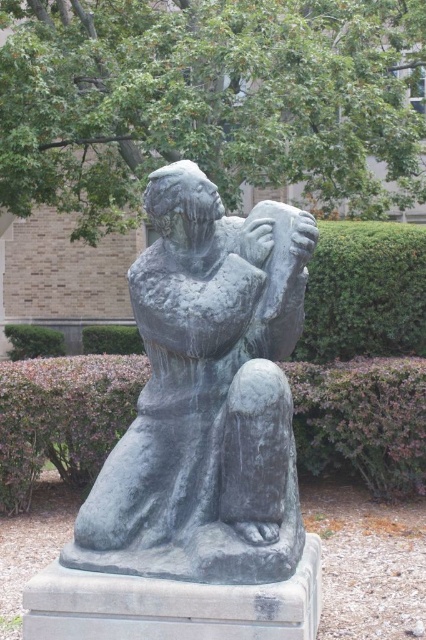
Is green leafy tree at upper center above purple shrubbery at lower center?

Yes.

At what (x,y) coordinates should I click in order to perform the action: click on green leafy tree at upper center. Please return your answer as a coordinate pair (x, y). This screenshot has width=426, height=640. Looking at the image, I should click on (204, 99).

Does green leafy tree at upper center appear on the left side of bronze statue at center?

Correct, you'll find green leafy tree at upper center to the left of bronze statue at center.

Who is more forward, (333, 42) or (305, 268)?

Point (305, 268)

The height and width of the screenshot is (640, 426). I want to click on green leafy tree at upper center, so click(x=204, y=99).

Is bronze statue at center thinner than purple shrubbery at lower center?

Indeed, bronze statue at center has a lesser width compared to purple shrubbery at lower center.

Does point (307, 228) come closer to viewer compared to point (115, 438)?

Yes.

This screenshot has width=426, height=640. What are the coordinates of `bronze statue at center` in the screenshot? It's located at (206, 397).

The width and height of the screenshot is (426, 640). I want to click on bronze statue at center, so click(206, 397).